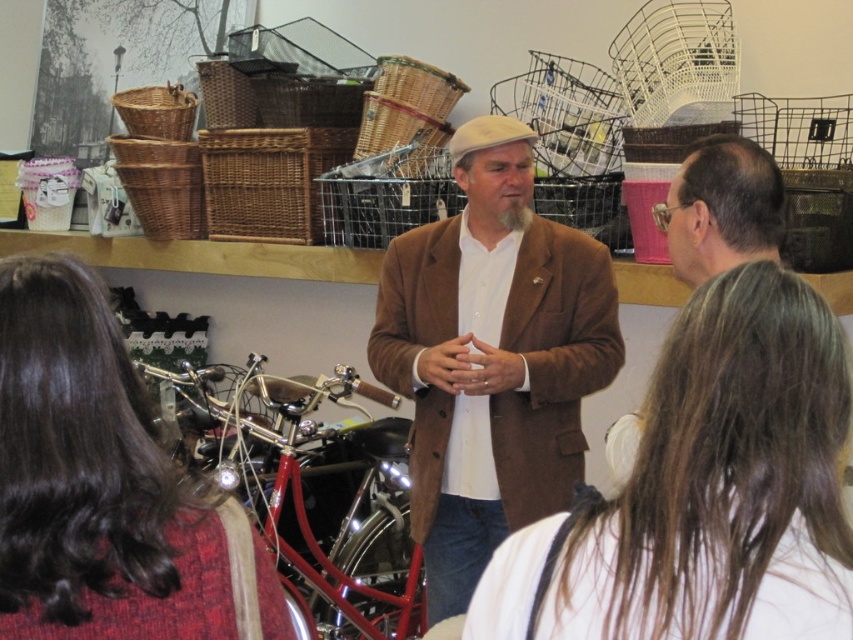
Question: Does brown woolen coat at center come in front of dark brown hair at center?

Choices:
 (A) no
 (B) yes

Answer: (A)

Question: Which object is positioned closest to the smooth brown hair at center?

Choices:
 (A) brown woolen coat at center
 (B) shiny chrome motorcycle at center

Answer: (A)

Question: Which object is farther from the camera taking this photo?

Choices:
 (A) dark brown hair at center
 (B) smooth brown hair at center
 (C) shiny chrome motorcycle at center

Answer: (C)

Question: Is smooth brown hair at center bigger than dark brown hair at center?

Choices:
 (A) yes
 (B) no

Answer: (A)

Question: Is the position of brown woolen coat at center less distant than that of shiny chrome motorcycle at center?

Choices:
 (A) yes
 (B) no

Answer: (A)

Question: Which point is closer to the camera?

Choices:
 (A) (770, 333)
 (B) (405, 564)
 (C) (125, 595)

Answer: (A)